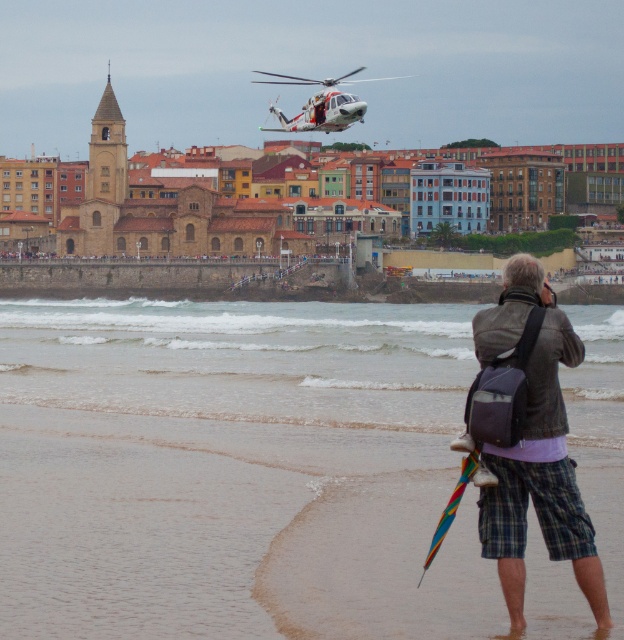
Between leather jacket at lower right and white matte helicopter at upper center, which one is positioned higher?

white matte helicopter at upper center is higher up.

Measure the distance from leather jacket at lower right to white matte helicopter at upper center.

leather jacket at lower right and white matte helicopter at upper center are 158.91 meters apart from each other.

Who is more distant from viewer, (582,584) or (306,124)?

The point (306,124) is more distant.

This screenshot has height=640, width=624. In order to click on leather jacket at lower right in this screenshot , I will do `click(534, 449)`.

Between sandy beach at lower left and leather jacket at lower right, which one appears on the left side from the viewer's perspective?

sandy beach at lower left

Does sandy beach at lower left come in front of leather jacket at lower right?

No, it is not.

Between point (497, 625) and point (504, 483), which one is positioned behind?

Positioned behind is point (504, 483).

The width and height of the screenshot is (624, 640). In order to click on sandy beach at lower left in this screenshot , I will do `click(197, 445)`.

Which is below, sandy beach at lower left or white matte helicopter at upper center?

Positioned lower is sandy beach at lower left.

Does sandy beach at lower left appear on the right side of white matte helicopter at upper center?

Incorrect, sandy beach at lower left is not on the right side of white matte helicopter at upper center.

Between point (117, 449) and point (280, 124), which one is positioned in front?

Point (117, 449) is in front.

This screenshot has height=640, width=624. In order to click on sandy beach at lower left in this screenshot , I will do `click(197, 445)`.